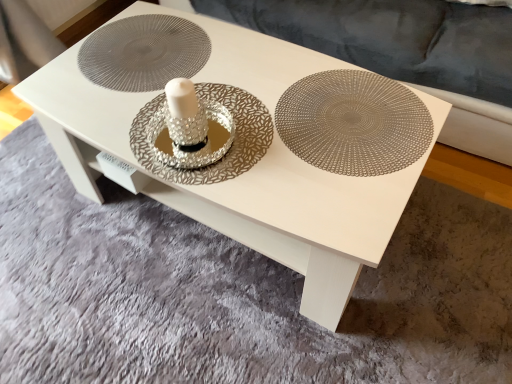
Locate an element on the screen. This screenshot has height=384, width=512. free space in front of metallic silver plate at center is located at coordinates (331, 205).